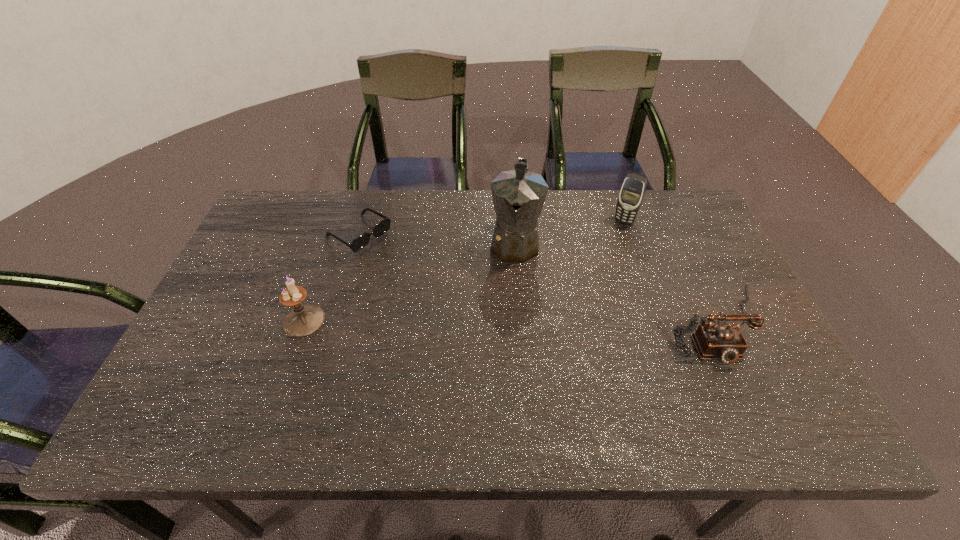
You are a GUI agent. You are given a task and a screenshot of the screen. Output one action in this format:
    pyautogui.click(x=<x>, y=<y>)
    Task: Click on the candle holder
    
    Given the screenshot: What is the action you would take?
    point(304,320)

This screenshot has width=960, height=540. Find the location of `telephone`. telephone is located at coordinates (725, 342).

Locate an element on the screen. The image size is (960, 540). the third object from left to right is located at coordinates (518, 195).

Image resolution: width=960 pixels, height=540 pixels. In order to click on coffeepot in this screenshot , I will do `click(518, 195)`.

Identify the location of sunglasses. This screenshot has width=960, height=540. (361, 241).

Identify the location of cellular telephone. The width and height of the screenshot is (960, 540). (632, 192).

The height and width of the screenshot is (540, 960). What are the coordinates of `vacant space located on the right of the candle holder` in the screenshot? It's located at (464, 321).

At what (x,y) coordinates should I click in order to perform the action: click on free region located on the dial of the telephone. Please return your answer as a coordinate pair (x, y). Looking at the image, I should click on (749, 393).

Image resolution: width=960 pixels, height=540 pixels. I want to click on free space located 0.090m on the pouring side of the third object from left to right, so click(x=510, y=295).

Where is `vacant space located on the pouring side of the third object from left to right`? The image size is (960, 540). vacant space located on the pouring side of the third object from left to right is located at coordinates (506, 327).